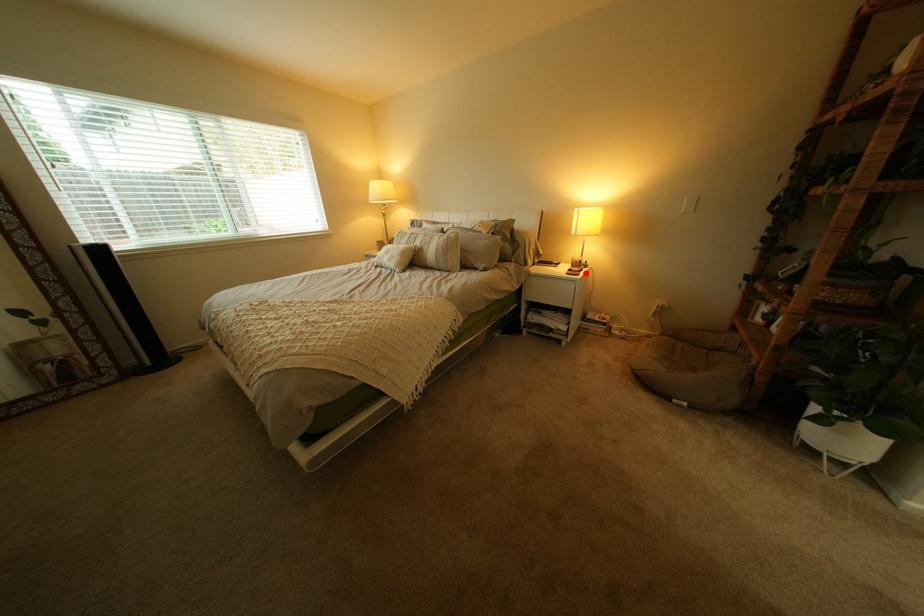
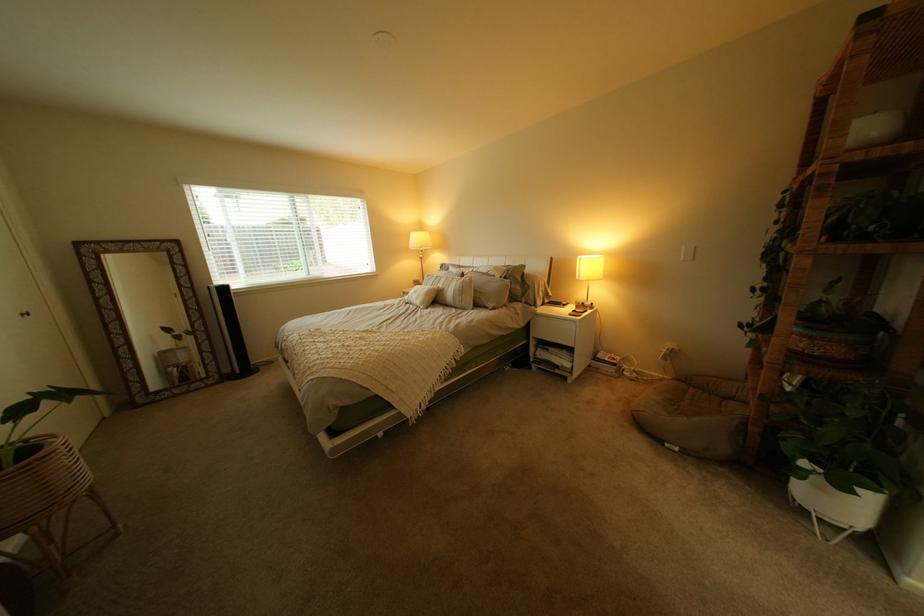
In the second image, find the point that corresponds to the highlighted location in the first image.

(590, 314)